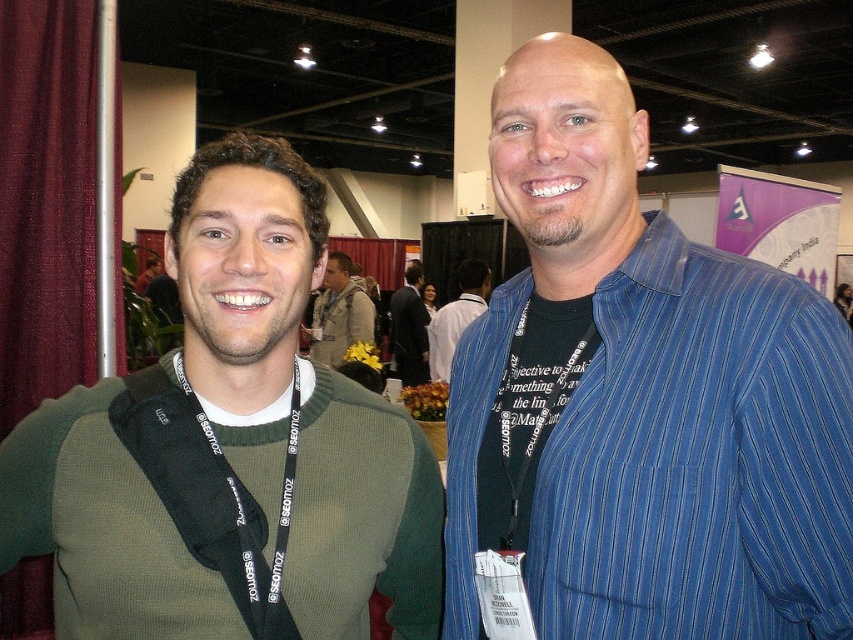
Between point (122, 632) and point (444, 374), which one is positioned behind?

Point (444, 374)

Can you confirm if green knitted sweater at left is positioned below blue striped shirt at right?

Correct, green knitted sweater at left is located below blue striped shirt at right.

What do you see at coordinates (231, 445) in the screenshot? The width and height of the screenshot is (853, 640). I see `green knitted sweater at left` at bounding box center [231, 445].

Identify the location of green knitted sweater at left. tap(231, 445).

Does green sweater at center appear on the right side of dark blue shirt at center?

In fact, green sweater at center is to the left of dark blue shirt at center.

Can you confirm if green sweater at center is positioned below dark blue shirt at center?

Correct, green sweater at center is located below dark blue shirt at center.

Does point (329, 291) come in front of point (426, 372)?

Yes, it is.

At what (x,y) coordinates should I click in order to perform the action: click on green sweater at center. Please return your answer as a coordinate pair (x, y). Looking at the image, I should click on (339, 314).

Is blue striped shirt at right shorter than dark blue shirt at center?

Yes.

Is point (447, 317) positioned before point (405, 380)?

That is True.

Looking at this image, who is more distant from viewer, (480,310) or (393,330)?

The point (393,330) is more distant.

This screenshot has width=853, height=640. Find the location of `blue striped shirt at right`. blue striped shirt at right is located at coordinates (456, 316).